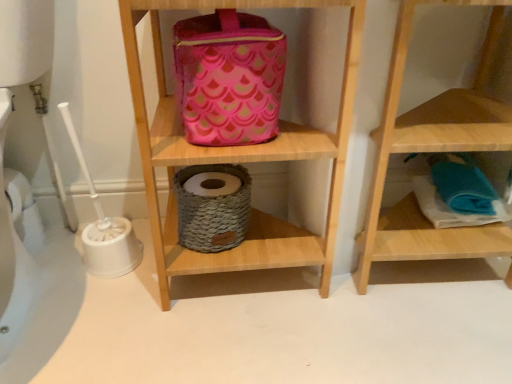
Question: Based on their sizes in the image, would you say pink fabric bag at upper center, arranged as the 1th shelf when viewed from the left, is bigger or smaller than pink fabric pouch at upper center?

Choices:
 (A) small
 (B) big

Answer: (B)

Question: From the image's perspective, is pink fabric bag at upper center, the 2th shelf viewed from the right, above or below pink fabric pouch at upper center?

Choices:
 (A) below
 (B) above

Answer: (A)

Question: Which object is the closest to the pink fabric pouch at upper center?

Choices:
 (A) wooden towel at lower right, acting as the first shelf starting from the right
 (B) pink fabric bag at upper center, the 2th shelf viewed from the right

Answer: (B)

Question: Which of these objects is positioned farthest from the wooden towel at lower right, acting as the first shelf starting from the right?

Choices:
 (A) pink fabric bag at upper center, the 2th shelf viewed from the right
 (B) pink fabric pouch at upper center

Answer: (B)